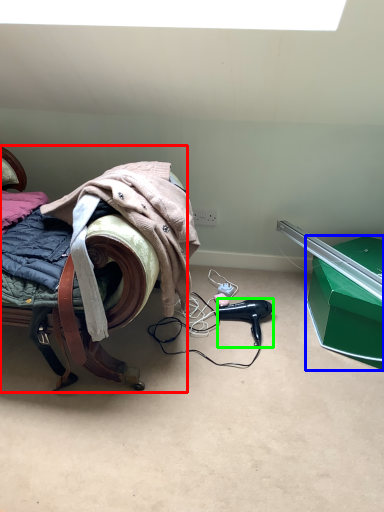
Question: Which object is positioned closest to furniture (highlighted by a red box)? Select from box (highlighted by a blue box) and hair dryer (highlighted by a green box).

Choices:
 (A) box
 (B) hair dryer

Answer: (B)